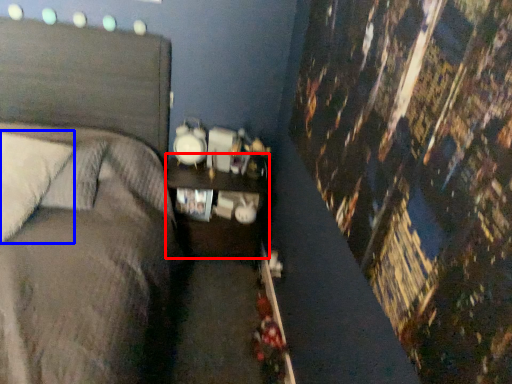
Question: Which point is closer to the camera, nightstand (highlighted by a red box) or pillow (highlighted by a blue box)?

Choices:
 (A) nightstand
 (B) pillow

Answer: (B)